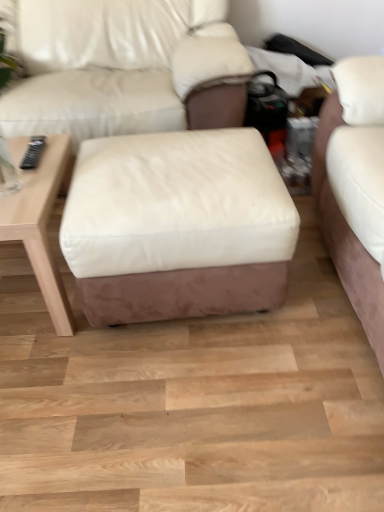
Question: Considering the positions of matte white leather couch at center and wooden table at left in the image, is matte white leather couch at center wider or thinner than wooden table at left?

Choices:
 (A) thin
 (B) wide

Answer: (B)

Question: In terms of size, does matte white leather couch at center appear bigger or smaller than wooden table at left?

Choices:
 (A) small
 (B) big

Answer: (B)

Question: Considering the real-world distances, which object is closest to the wooden table at left?

Choices:
 (A) matte white leather couch at center
 (B) white leather ottoman at center

Answer: (B)

Question: Estimate the real-world distances between objects in this image. Which object is closer to the white leather ottoman at center?

Choices:
 (A) matte white leather couch at center
 (B) wooden table at left

Answer: (B)